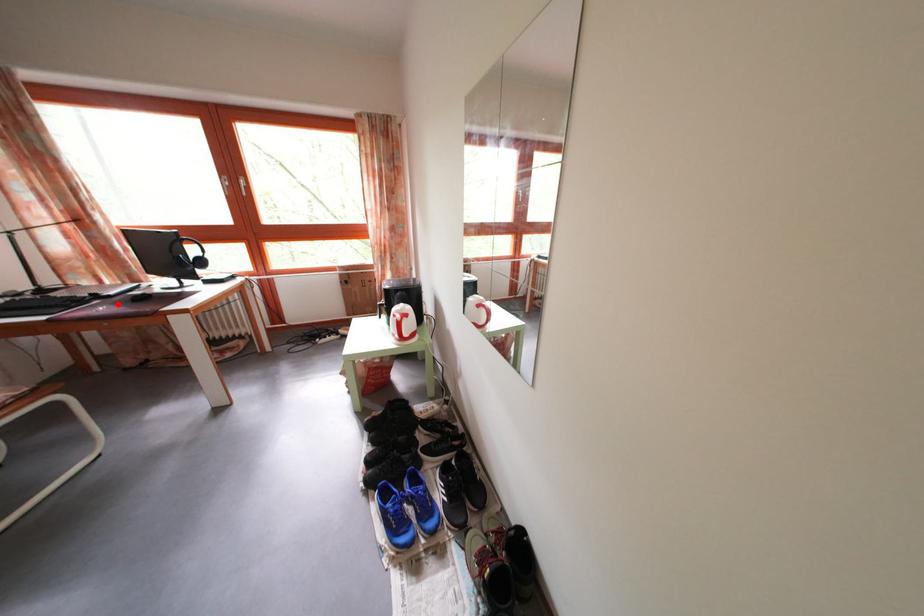
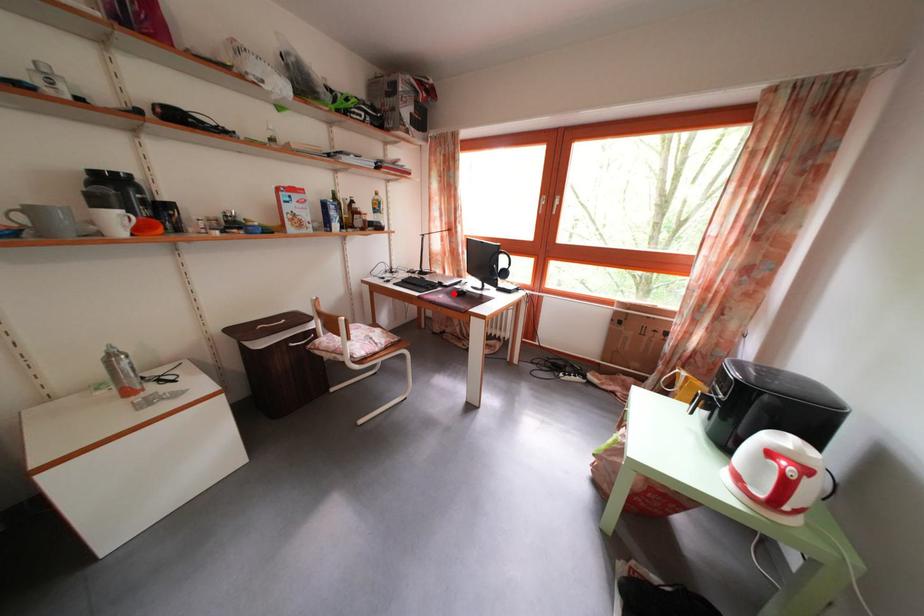
I am providing you with two images of the same scene from different viewpoints. A red point is marked on the first image and another point is marked on the second image. Is the red point in image1 aligned with the point shown in image2?

Yes